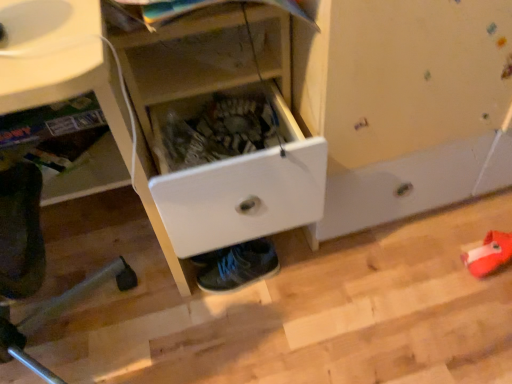
Where is `vacant space that is in between white plastic drawer at lower center and shiny blue sneakers at lower center`? This screenshot has height=384, width=512. vacant space that is in between white plastic drawer at lower center and shiny blue sneakers at lower center is located at coordinates (183, 320).